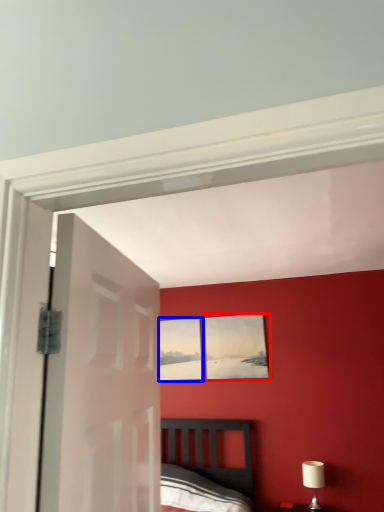
Question: Which point is closer to the camera, picture frame (highlighted by a red box) or picture frame (highlighted by a blue box)?

Choices:
 (A) picture frame
 (B) picture frame

Answer: (A)